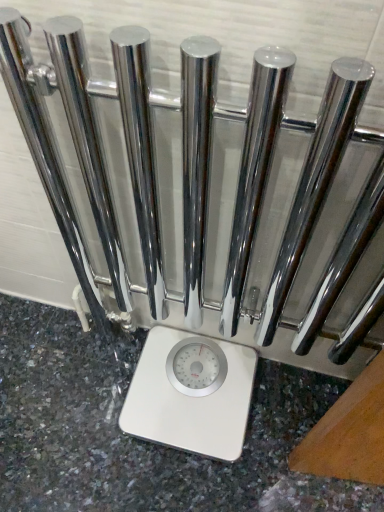
At what (x,y) coordinates should I click in order to perform the action: click on white glossy scale at center. Please return your answer as a coordinate pair (x, y). The width and height of the screenshot is (384, 512). Looking at the image, I should click on (191, 393).

The image size is (384, 512). What do you see at coordinates (191, 393) in the screenshot?
I see `white glossy scale at center` at bounding box center [191, 393].

Describe the element at coordinates (141, 440) in the screenshot. I see `white glossy granite at center` at that location.

This screenshot has height=512, width=384. I want to click on white glossy granite at center, so click(x=141, y=440).

This screenshot has width=384, height=512. Identify the location of white glossy scale at center. (191, 393).

Does white glossy granite at center appear on the right side of white glossy scale at center?

No, white glossy granite at center is not to the right of white glossy scale at center.

Which is in front, white glossy granite at center or white glossy scale at center?

Positioned in front is white glossy granite at center.

Based on the photo, which is closer, (280, 496) or (232, 425)?

Point (280, 496).

From the image's perspective, is white glossy granite at center on white glossy scale at center?

No, from the image's perspective, white glossy granite at center is not on top of white glossy scale at center.

From a real-world perspective, does white glossy granite at center stand above white glossy scale at center?

No, from a real-world perspective, white glossy granite at center is not over white glossy scale at center

Can you confirm if white glossy granite at center is wider than white glossy scale at center?

Correct, the width of white glossy granite at center exceeds that of white glossy scale at center.

From their relative heights in the image, would you say white glossy granite at center is taller or shorter than white glossy scale at center?

Clearly, white glossy granite at center is shorter compared to white glossy scale at center.

In the scene shown: Who is smaller, white glossy granite at center or white glossy scale at center?

white glossy scale at center is smaller.

Do you think white glossy granite at center is within white glossy scale at center, or outside of it?

white glossy granite at center lies outside white glossy scale at center.

Is white glossy granite at center next to white glossy scale at center and touching it?

white glossy granite at center and white glossy scale at center are clearly separated.

Is white glossy granite at center facing towards white glossy scale at center?

Yes, white glossy granite at center faces towards white glossy scale at center.

How many degrees apart are the facing directions of white glossy granite at center and white glossy scale at center?

They differ by 88.8 degrees in their facing directions.

Measure the distance between white glossy granite at center and white glossy scale at center.

A distance of 4.50 inches exists between white glossy granite at center and white glossy scale at center.

The image size is (384, 512). Find the location of `scale behind the white glossy granite at center`. scale behind the white glossy granite at center is located at coordinates (191, 393).

Can you confirm if white glossy scale at center is positioned to the right of white glossy granite at center?

Yes.

Does white glossy scale at center come behind white glossy granite at center?

Yes, white glossy scale at center is further from the camera.

Is point (206, 371) farther from camera compared to point (7, 495)?

Yes.

From the picture: From the image's perspective, is white glossy scale at center beneath white glossy granite at center?

Incorrect, from the image's perspective, white glossy scale at center is higher than white glossy granite at center.

From a real-world perspective, is white glossy scale at center positioned above or below white glossy granite at center?

white glossy scale at center is above white glossy granite at center.

Is white glossy scale at center wider than white glossy granite at center?

No, white glossy scale at center is not wider than white glossy granite at center.

Can you confirm if white glossy scale at center is taller than white glossy granite at center?

Indeed, white glossy scale at center has a greater height compared to white glossy granite at center.

Consider the image. Which of these two, white glossy scale at center or white glossy granite at center, is bigger?

With larger size is white glossy granite at center.

Is white glossy scale at center surrounding white glossy granite at center?

Definitely not — white glossy granite at center is not inside white glossy scale at center.

Is white glossy scale at center next to white glossy granite at center?

No.

Is white glossy scale at center positioned with its back to white glossy granite at center?

Yes, white glossy scale at center's orientation is away from white glossy granite at center.

Can you tell me how much white glossy scale at center and white glossy granite at center differ in facing direction?

There is a 88.8-degree angle between the facing directions of white glossy scale at center and white glossy granite at center.

At what (x,y) coordinates should I click in order to perform the action: click on granite below the white glossy scale at center (from the image's perspective). Please return your answer as a coordinate pair (x, y). Looking at the image, I should click on (141, 440).

At what (x,y) coordinates should I click in order to perform the action: click on granite below the white glossy scale at center (from the image's perspective). Please return your answer as a coordinate pair (x, y). The image size is (384, 512). Looking at the image, I should click on (141, 440).

Locate an element on the screen. The height and width of the screenshot is (512, 384). granite below the white glossy scale at center (from a real-world perspective) is located at coordinates (141, 440).